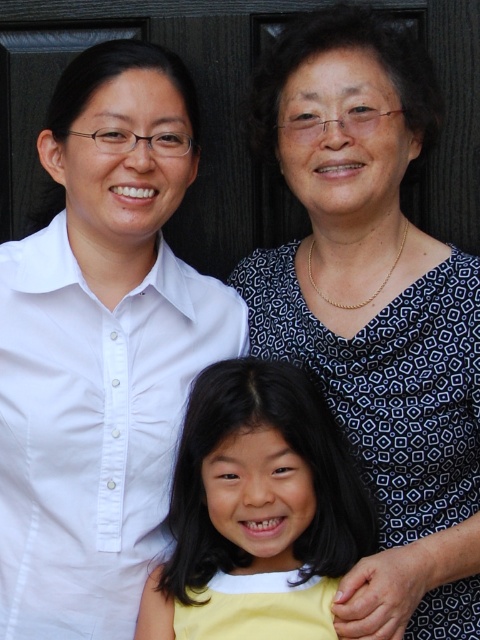
Question: Which point is farther to the camera?

Choices:
 (A) (417, 250)
 (B) (86, 346)

Answer: (A)

Question: Which of the following is the closest to the observer?

Choices:
 (A) yellow fabric dress at center
 (B) matte black blouse at upper right
 (C) patterned fabric blouse at center

Answer: (C)

Question: Is matte black blouse at upper right smaller than patterned fabric blouse at center?

Choices:
 (A) yes
 (B) no

Answer: (A)

Question: Which point is closer to the camera?

Choices:
 (A) yellow fabric dress at center
 (B) matte black blouse at upper right
 (C) patterned fabric blouse at center

Answer: (C)

Question: Can you confirm if matte black blouse at upper right is wider than yellow fabric dress at center?

Choices:
 (A) yes
 (B) no

Answer: (A)

Question: Does patterned fabric blouse at center have a larger size compared to yellow fabric dress at center?

Choices:
 (A) no
 (B) yes

Answer: (B)